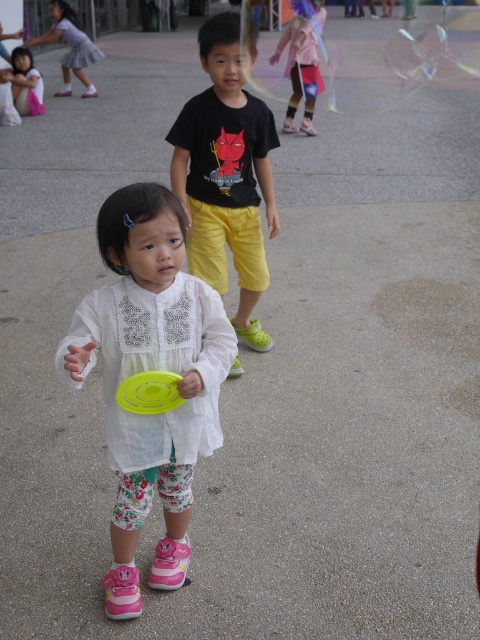
Question: Is white floral leggings at center to the right of pink fabric dress at upper center from the viewer's perspective?

Choices:
 (A) no
 (B) yes

Answer: (A)

Question: Which point appears farthest from the camera in this image?

Choices:
 (A) (96, 52)
 (B) (230, 26)

Answer: (A)

Question: From the image, what is the correct spatial relationship of matte black t-shirt at upper center in relation to matte pink skirt at upper left?

Choices:
 (A) left
 (B) right

Answer: (B)

Question: Among these points, which one is farthest from the camera?

Choices:
 (A) (212, 92)
 (B) (43, 109)

Answer: (B)

Question: Which point is farther to the camera?

Choices:
 (A) matte black t-shirt at upper center
 (B) matte pink skirt at upper left

Answer: (B)

Question: Observing the image, what is the correct spatial positioning of pink fabric dress at upper center in reference to yellow plastic frisbee at center?

Choices:
 (A) above
 (B) below

Answer: (A)